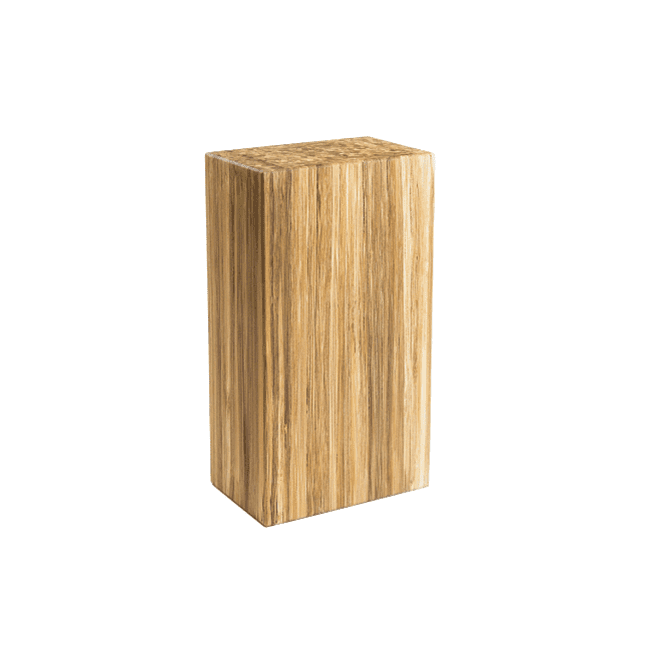
Locate an element on the screen. shorter face of butcher block is located at coordinates (231, 302).